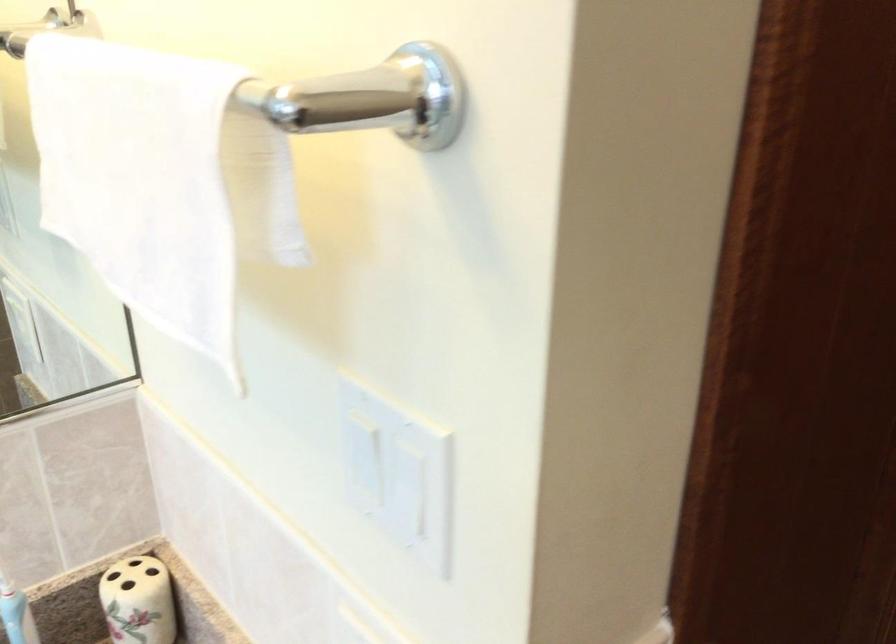
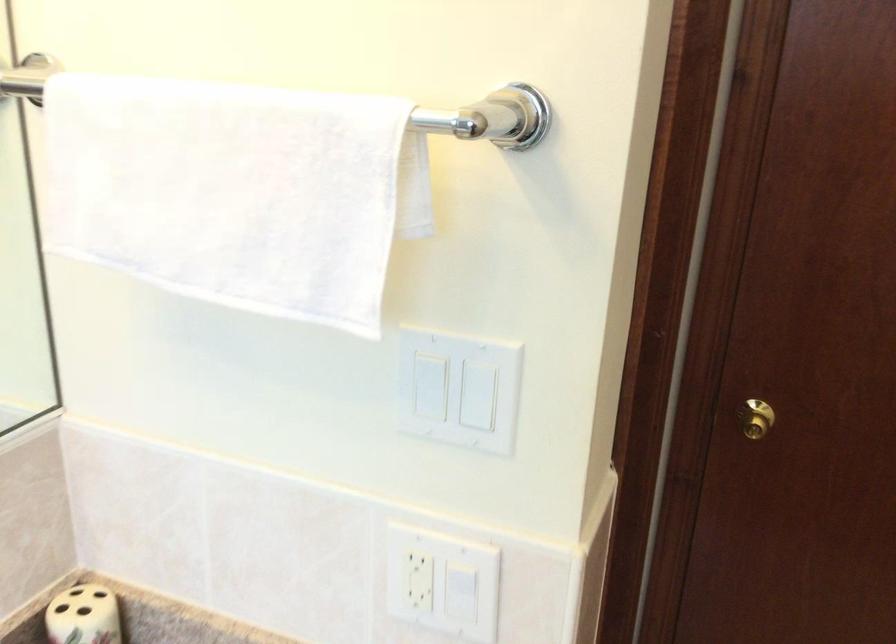
The point at (150, 167) is marked in the first image. Where is the corresponding point in the second image?

(229, 191)